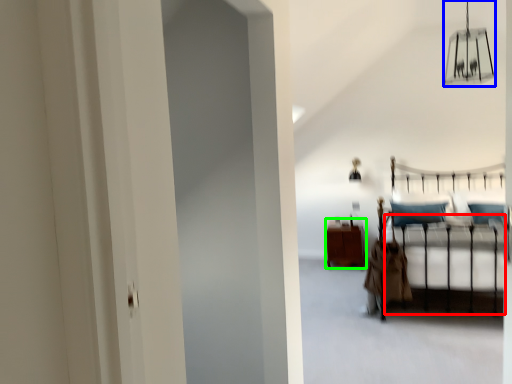
Question: Which object is the farthest from bed frame (highlighted by a red box)? Choose among these: lamp (highlighted by a blue box) or furniture (highlighted by a green box).

Choices:
 (A) lamp
 (B) furniture

Answer: (A)